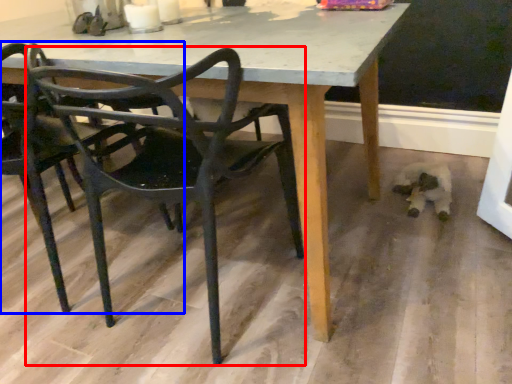
Question: Among these objects, which one is nearest to the camera, chair (highlighted by a red box) or chair (highlighted by a blue box)?

Choices:
 (A) chair
 (B) chair

Answer: (A)